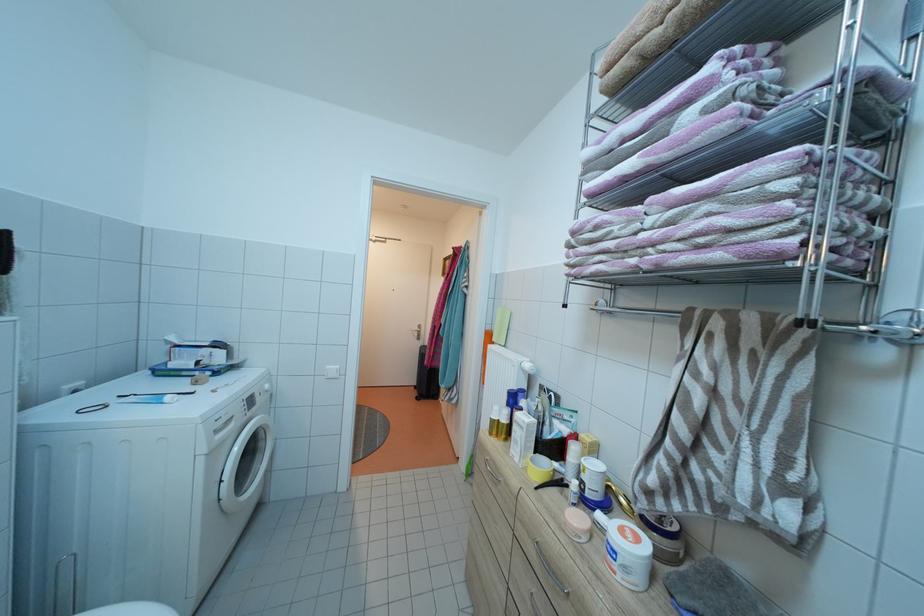
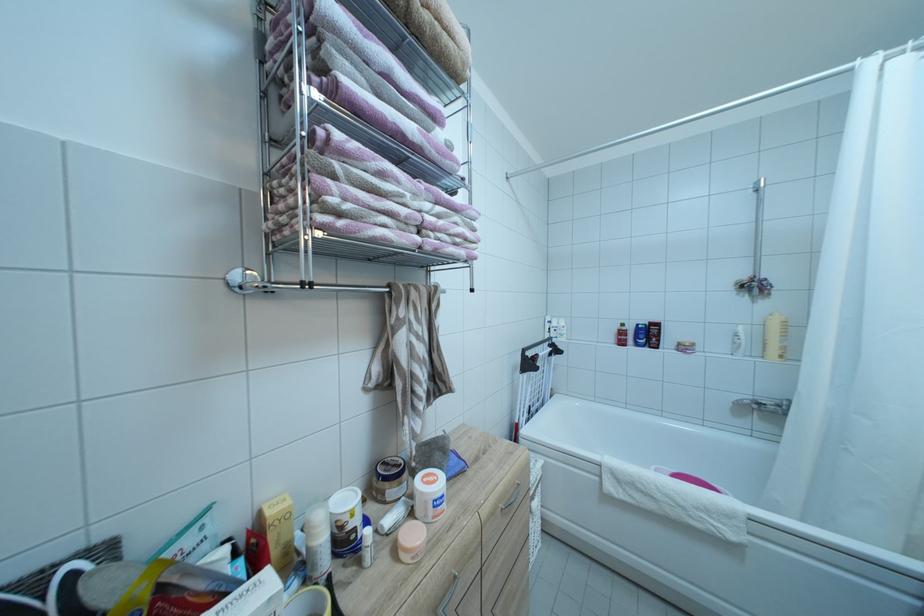
In the second image, find the point that corresponds to point (678, 214) in the first image.

(444, 209)